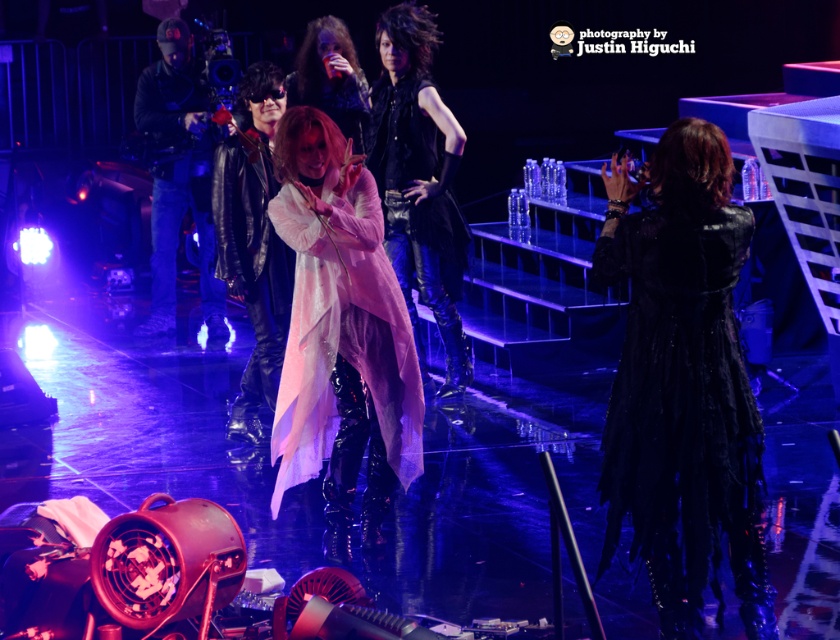
Question: Can you confirm if black leather coat at right is thinner than pink matte coat at center?

Choices:
 (A) no
 (B) yes

Answer: (B)

Question: Is shiny pink fabric dress at center further to camera compared to matte black camera at left?

Choices:
 (A) yes
 (B) no

Answer: (B)

Question: Which of the following is the closest to the observer?

Choices:
 (A) (344, 124)
 (B) (318, 392)
 (C) (153, 173)
 (D) (746, 474)

Answer: (D)

Question: Where is black leather coat at right located in relation to matte black camera at left in the image?

Choices:
 (A) right
 (B) left

Answer: (A)

Question: Which point is closer to the camera?

Choices:
 (A) shiny pink fabric dress at center
 (B) black leather coat at right

Answer: (B)

Question: Which of the following is the closest to the observer?

Choices:
 (A) (665, 356)
 (B) (203, 92)
 (C) (339, 68)
 (D) (386, 189)

Answer: (A)